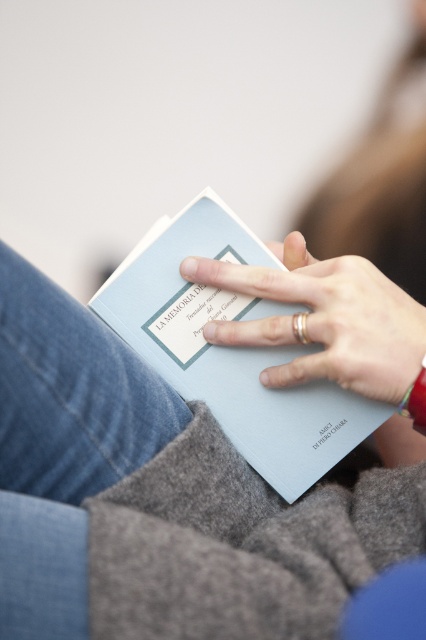
Question: Is light blue matte paper at center bigger than smooth skin hand at center?

Choices:
 (A) no
 (B) yes

Answer: (B)

Question: Can you confirm if light blue matte paper at center is thinner than smooth skin hand at center?

Choices:
 (A) no
 (B) yes

Answer: (A)

Question: Is light blue matte paper at center smaller than smooth skin hand at center?

Choices:
 (A) no
 (B) yes

Answer: (A)

Question: Which of the following is the closest to the observer?

Choices:
 (A) light blue matte paper at center
 (B) smooth skin hand at center

Answer: (B)

Question: Which object is closer to the camera taking this photo?

Choices:
 (A) light blue matte paper at center
 (B) smooth skin hand at center

Answer: (B)

Question: Which point is farther from the camera taking this photo?

Choices:
 (A) (345, 298)
 (B) (155, 330)

Answer: (B)